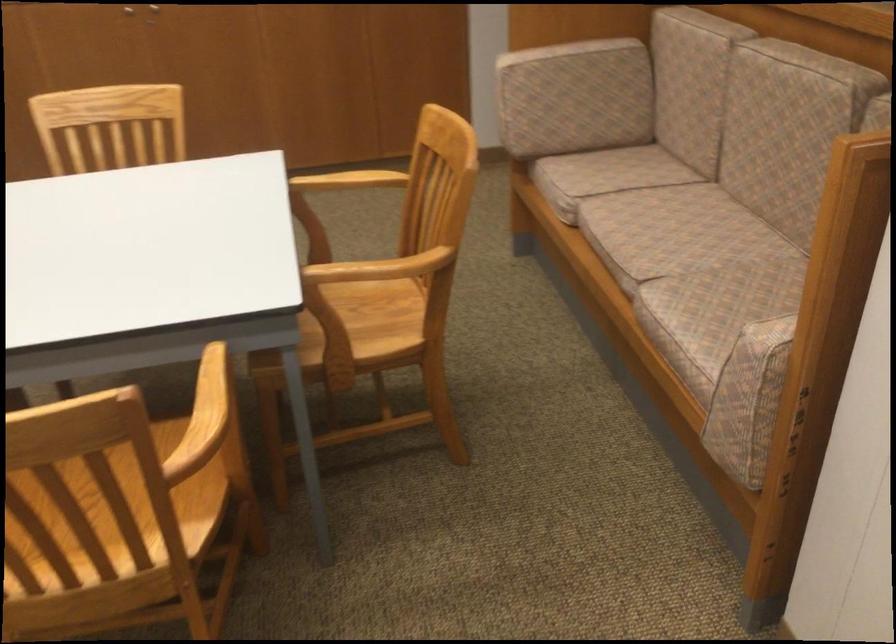
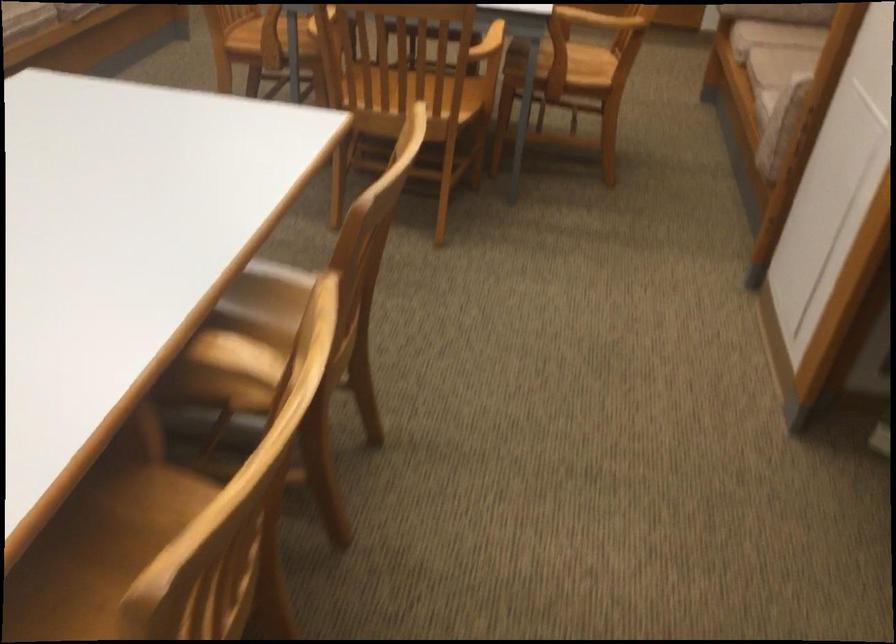
Find the pixel in the second image that matches (x=609, y=178) in the first image.

(782, 33)